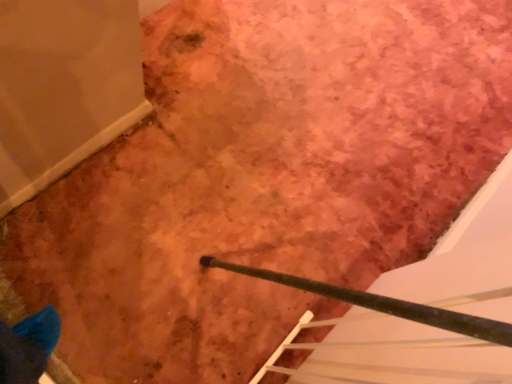
Locate an element on the screen. The width and height of the screenshot is (512, 384). smooth metal stairs at center is located at coordinates (384, 354).

Measure the distance between smooth metal stairs at center and camera.

20.24 inches.

Describe the element at coordinates (384, 354) in the screenshot. I see `smooth metal stairs at center` at that location.

I want to click on smooth metal stairs at center, so 384,354.